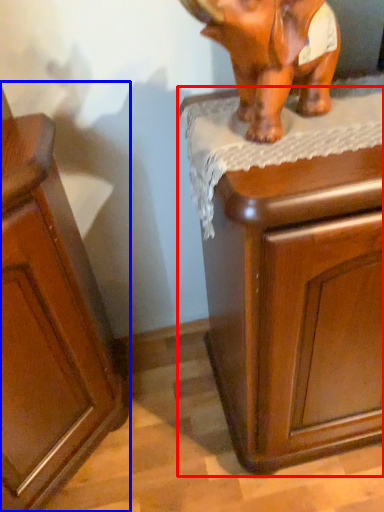
Question: Which object is further to the camera taking this photo, chest of drawers (highlighted by a red box) or cabinetry (highlighted by a blue box)?

Choices:
 (A) chest of drawers
 (B) cabinetry

Answer: (A)